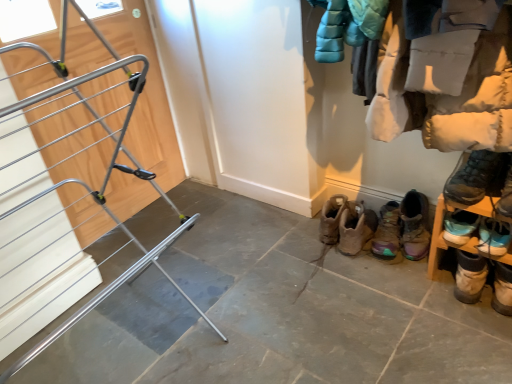
Find the location of a particular element. vacant area that is in front of multicolored suede boot at lower right, which ranks as the fourth footwear in right-to-left order is located at coordinates (412, 283).